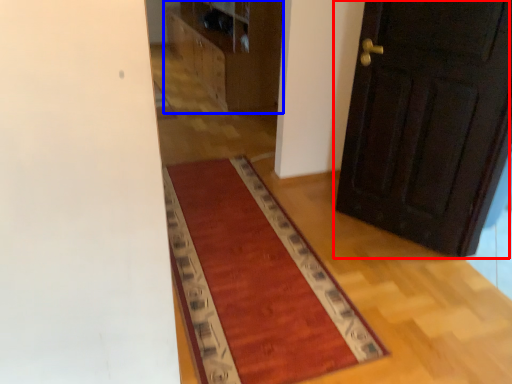
Question: Which object is closer to the camera taking this photo, door (highlighted by a red box) or dresser (highlighted by a blue box)?

Choices:
 (A) door
 (B) dresser

Answer: (A)